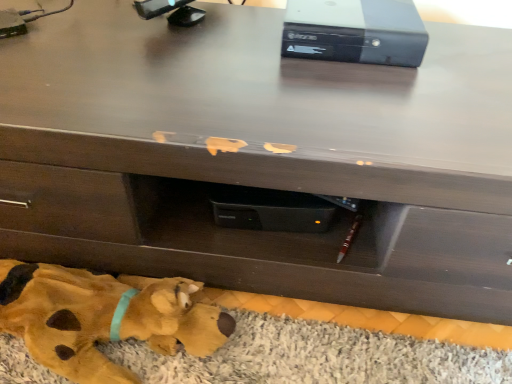
At what (x,y) coordinates should I click in order to perform the action: click on free spot above yellow fabric mat at lower left (from a real-world perspective). Please return your answer as a coordinate pair (x, y). This screenshot has width=512, height=384. Looking at the image, I should click on tap(249, 357).